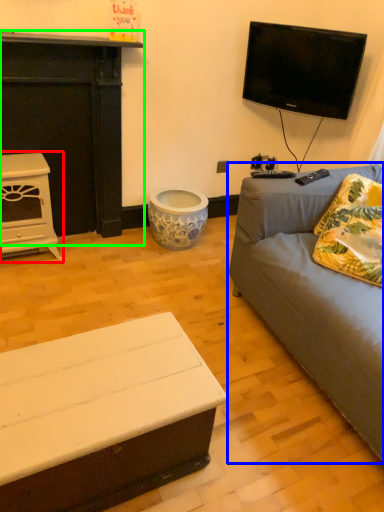
Question: Which is farther away from fireplace (highlighted by a red box)? studio couch (highlighted by a blue box) or fireplace (highlighted by a green box)?

Choices:
 (A) studio couch
 (B) fireplace

Answer: (A)